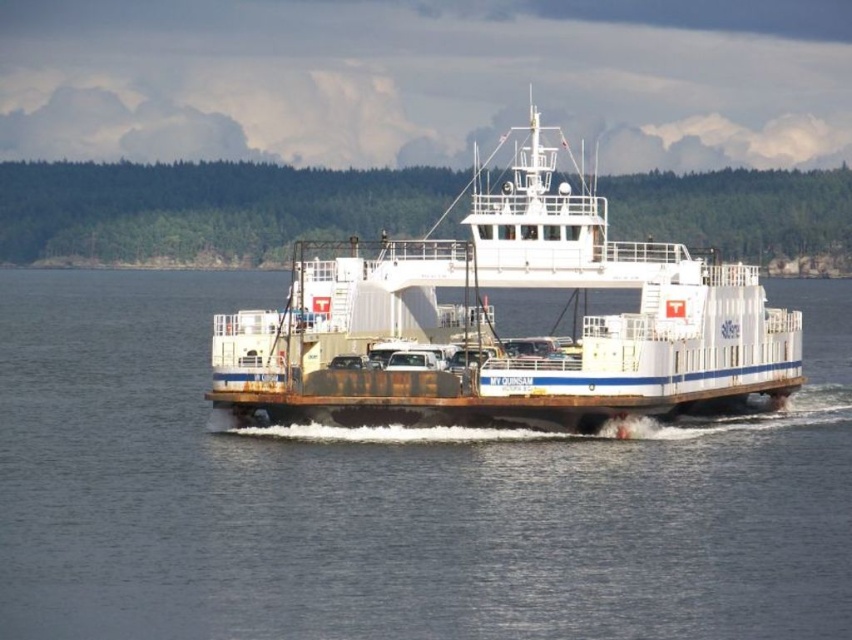
You are a passenger on the MV Quinsam ferry and you want to take a photo of the ferry from the water surface. Where should you position yourself relative to the white matte ferry at center to capture the reflection of the ferry in the white matte water at center?

You should position yourself below the white matte ferry at center because the white matte water at center is below it, allowing you to see its reflection in the water.

You are standing on the deck of the MV Quinsam ferry and want to know how far the point at coordinates (x=130, y=435) is from your current position. Can you determine the distance?

The point at coordinates (x=130, y=435) is 346.94 feet away from your current position on the MV Quinsam ferry deck.